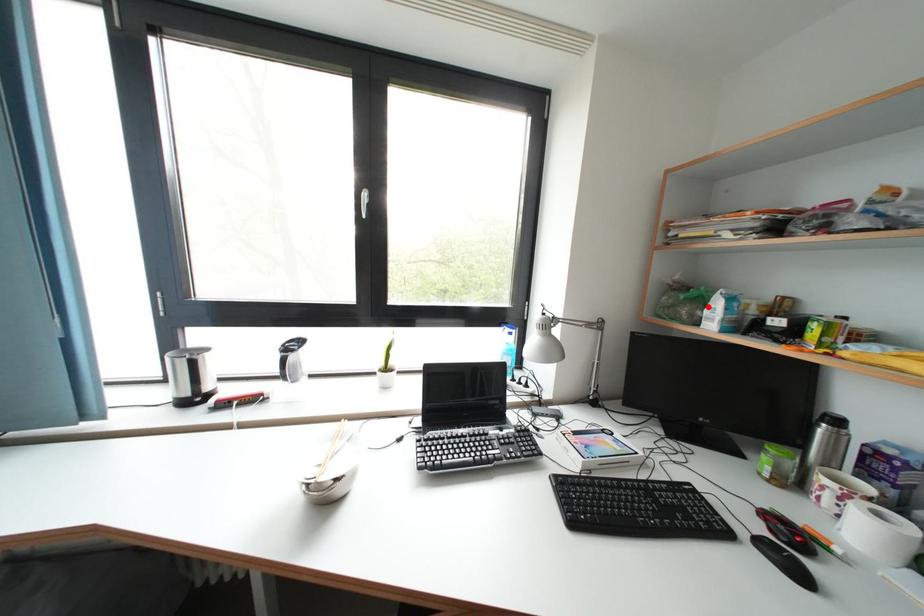
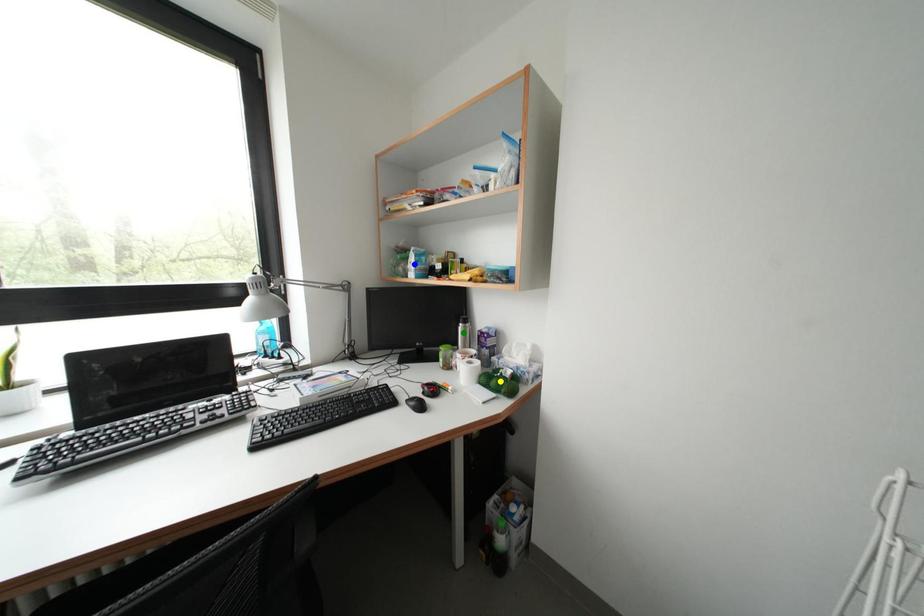
Question: I am providing you with two images of the same scene from different viewpoints. A red point is marked on the first image. You are given multiple points on the second image. Which point in image 2 represents the same 3d spot as the red point in image 1?

Choices:
 (A) blue point
 (B) green point
 (C) yellow point

Answer: (A)